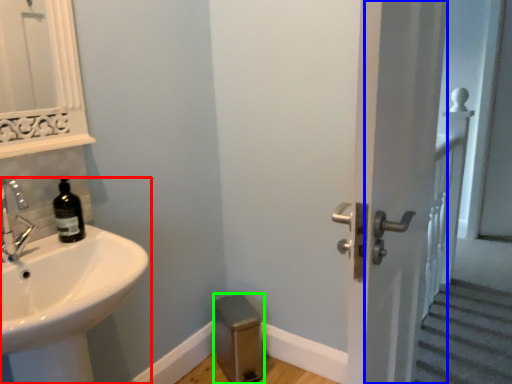
Question: Considering the real-world distances, which object is closest to sink (highlighted by a red box)? screen door (highlighted by a blue box) or step stool (highlighted by a green box).

Choices:
 (A) screen door
 (B) step stool

Answer: (A)